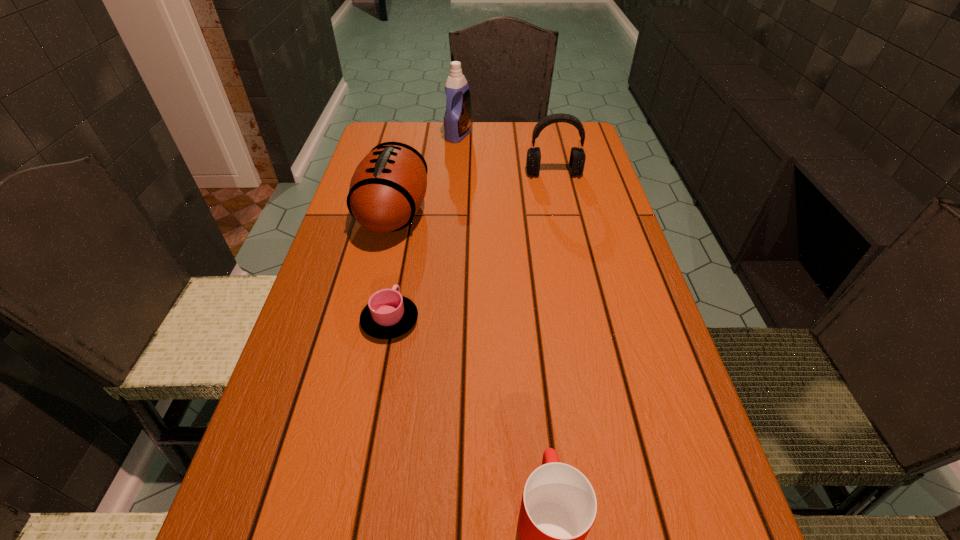
The width and height of the screenshot is (960, 540). Identify the location of the third object from left to right. (457, 119).

I want to click on detergent, so click(x=457, y=119).

The width and height of the screenshot is (960, 540). Find the location of `headset`. headset is located at coordinates (577, 156).

Find the location of `the third nearest object`. the third nearest object is located at coordinates (388, 187).

Where is `the left cup`? The image size is (960, 540). the left cup is located at coordinates (388, 314).

The image size is (960, 540). In order to click on the shortest object in this screenshot , I will do `click(388, 314)`.

Identify the location of free space located on the right of the tallest object. The image size is (960, 540). (492, 136).

Identify the location of vacant space located on the headband of the headset. (570, 251).

The width and height of the screenshot is (960, 540). I want to click on vacant space situated 0.050m on the front of the third nearest object, so click(382, 266).

Locate an element on the screen. The width and height of the screenshot is (960, 540). free spot located on the side with the handle of the fourth farthest object is located at coordinates (x=412, y=202).